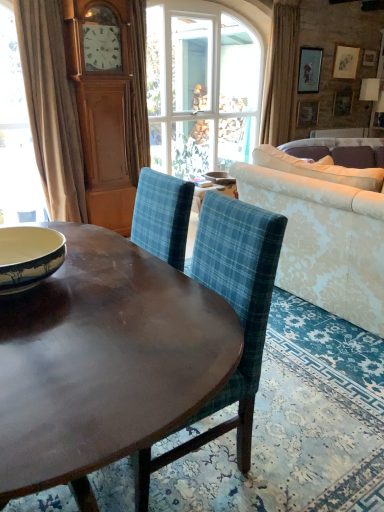
Image resolution: width=384 pixels, height=512 pixels. Describe the element at coordinates (307, 113) in the screenshot. I see `wooden picture frame at upper right, the 1th picture frame from the bottom` at that location.

This screenshot has width=384, height=512. What do you see at coordinates (309, 70) in the screenshot? I see `matte wooden picture frame at upper right, marked as the first picture frame in a top-to-bottom arrangement` at bounding box center [309, 70].

This screenshot has height=512, width=384. What do you see at coordinates (51, 108) in the screenshot? I see `beige fabric curtain at left, the first curtain positioned from the left` at bounding box center [51, 108].

Image resolution: width=384 pixels, height=512 pixels. Describe the element at coordinates (280, 75) in the screenshot. I see `beige fabric curtain at upper right, the 1th curtain viewed from the back` at that location.

This screenshot has height=512, width=384. Identify the location of beige fabric curtain at upper right, the 1th curtain viewed from the back. (280, 75).

Image resolution: width=384 pixels, height=512 pixels. What do you see at coordinates (235, 311) in the screenshot? I see `blue plaid fabric chair at center` at bounding box center [235, 311].

Image resolution: width=384 pixels, height=512 pixels. Find the location of `clear glass window at center`. clear glass window at center is located at coordinates (201, 87).

This screenshot has width=384, height=512. What do you see at coordinates (201, 87) in the screenshot?
I see `clear glass window at center` at bounding box center [201, 87].

What are the coordinates of `shiny brown wood coffee table at center` in the screenshot? It's located at (104, 362).

From the picture: Considering the relative positions of matte wooden picture frame at upper right, the 2th picture frame in the bottom-to-top sequence, and clear glass window at center in the image provided, is matte wooden picture frame at upper right, the 2th picture frame in the bottom-to-top sequence, to the right of clear glass window at center from the viewer's perspective?

Correct, you'll find matte wooden picture frame at upper right, the 2th picture frame in the bottom-to-top sequence, to the right of clear glass window at center.

From the image's perspective, between matte wooden picture frame at upper right, marked as the first picture frame in a top-to-bottom arrangement, and clear glass window at center, which one is located above?

matte wooden picture frame at upper right, marked as the first picture frame in a top-to-bottom arrangement, appears higher in the image.

Considering the relative sizes of matte wooden picture frame at upper right, marked as the first picture frame in a top-to-bottom arrangement, and clear glass window at center in the image provided, is matte wooden picture frame at upper right, marked as the first picture frame in a top-to-bottom arrangement, smaller than clear glass window at center?

Indeed, matte wooden picture frame at upper right, marked as the first picture frame in a top-to-bottom arrangement, has a smaller size compared to clear glass window at center.

What's the angular difference between blue plaid fabric chair at center and beige fabric curtain at upper right, positioned as the second curtain in front-to-back order,'s facing directions?

The angle between the facing direction of blue plaid fabric chair at center and the facing direction of beige fabric curtain at upper right, positioned as the second curtain in front-to-back order, is 88.7 degrees.

Are blue plaid fabric chair at center and beige fabric curtain at upper right, the 1th curtain viewed from the back, far apart?

blue plaid fabric chair at center is positioned a significant distance from beige fabric curtain at upper right, the 1th curtain viewed from the back.

Based on the photo, could beige fabric curtain at upper right, the 1th curtain viewed from the back, be considered to be inside blue plaid fabric chair at center?

No.

Does blue plaid fabric chair at center have a larger size compared to beige fabric curtain at upper right, positioned as the second curtain in front-to-back order?

Yes.

Is blue and white ceramic bowl at left, which is counted as the 2th bowl, starting from the top, positioned far away from damask fabric couch at right?

Yes.

Relative to damask fabric couch at right, is blue and white ceramic bowl at left, marked as the 2th bowl in a back-to-front arrangement, in front or behind?

blue and white ceramic bowl at left, marked as the 2th bowl in a back-to-front arrangement, is positioned closer to the viewer than damask fabric couch at right.

Is blue and white ceramic bowl at left, the 2th bowl in the right-to-left sequence, not within damask fabric couch at right?

Yes, blue and white ceramic bowl at left, the 2th bowl in the right-to-left sequence, is located beyond the bounds of damask fabric couch at right.

The height and width of the screenshot is (512, 384). What are the coordinates of `bowl below the damask fabric couch at right (from the image's perspective)` in the screenshot? It's located at (28, 256).

Considering the relative sizes of clear glass window at center and shiny brown wood coffee table at center in the image provided, is clear glass window at center wider than shiny brown wood coffee table at center?

Incorrect, the width of clear glass window at center does not surpass that of shiny brown wood coffee table at center.

Do you think clear glass window at center is within shiny brown wood coffee table at center, or outside of it?

clear glass window at center is spatially situated outside shiny brown wood coffee table at center.

Which point is more distant from viewer, (178, 42) or (31, 448)?

The point (178, 42) is farther.

From a real-world perspective, which is physically above, damask fabric couch at right or white glossy bowl at center, which is the 2th bowl in front-to-back order?

In real-world perspective, damask fabric couch at right is above.

Considering the positions of objects damask fabric couch at right and white glossy bowl at center, acting as the second bowl starting from the bottom, in the image provided, who is behind, damask fabric couch at right or white glossy bowl at center, acting as the second bowl starting from the bottom,?

white glossy bowl at center, acting as the second bowl starting from the bottom, is behind.

Is damask fabric couch at right facing away from white glossy bowl at center, arranged as the 1th bowl when viewed from the top?

damask fabric couch at right is not turned away from white glossy bowl at center, arranged as the 1th bowl when viewed from the top.

Considering the points (277, 280) and (222, 182), which point is in front, point (277, 280) or point (222, 182)?

The point (277, 280) is in front.

The width and height of the screenshot is (384, 512). What are the coordinates of `bowl that is the 1st one when counting downward from the beige fabric curtain at left, the 1th curtain viewed from the front (from the image's perspective)` in the screenshot? It's located at (220, 178).

Consider the image. Considering the positions of objects beige fabric curtain at left, the first curtain positioned from the left, and white glossy bowl at center, the 1th bowl viewed from the right, in the image provided, who is more to the right, beige fabric curtain at left, the first curtain positioned from the left, or white glossy bowl at center, the 1th bowl viewed from the right,?

From the viewer's perspective, white glossy bowl at center, the 1th bowl viewed from the right, appears more on the right side.

Which is nearer, (77,194) or (220,174)?

Point (77,194) is farther from the camera than point (220,174).

Which is closer to the camera, (x=375, y=318) or (x=293, y=45)?

Point (x=375, y=318) is positioned closer to the camera compared to point (x=293, y=45).

Does damask fabric couch at right have a lesser width compared to beige fabric curtain at upper right, which is the first curtain from right to left?

No.

Consider the image. Which object is more forward, damask fabric couch at right or beige fabric curtain at upper right, the second curtain viewed from the left?

damask fabric couch at right is more forward.

Locate an element on the screen. the 1st picture frame behind the clear glass window at center, starting your count from the anchor is located at coordinates (309, 70).

Locate an element on the screen. curtain that is on the right side of blue plaid fabric chair at center is located at coordinates (280, 75).

When comparing their distances from matte wooden picture frame at upper right, the 2th picture frame in the bottom-to-top sequence, does blue and white ceramic bowl at left, the first bowl viewed from the left, or damask fabric couch at right seem further?

The object further to matte wooden picture frame at upper right, the 2th picture frame in the bottom-to-top sequence, is blue and white ceramic bowl at left, the first bowl viewed from the left.

Considering their positions, is wooden picture frame at upper right, the 1th picture frame from the bottom, positioned further to matte wooden picture frame at upper right, marked as the first picture frame in a top-to-bottom arrangement, than beige fabric curtain at left, the 1th curtain viewed from the front?

beige fabric curtain at left, the 1th curtain viewed from the front.

When comparing their distances from blue and white ceramic bowl at left, positioned as the 1th bowl in front-to-back order, does shiny brown wood coffee table at center or clear glass window at center seem closer?

shiny brown wood coffee table at center.

Based on their spatial positions, is matte wooden picture frame at upper right, marked as the first picture frame in a top-to-bottom arrangement, or beige fabric curtain at upper right, the 1th curtain viewed from the back, closer to white glossy bowl at center, placed as the second bowl when sorted from left to right?

beige fabric curtain at upper right, the 1th curtain viewed from the back.

Consider the image. When comparing their distances from beige fabric curtain at upper right, the second curtain viewed from the left, does white glossy bowl at center, arranged as the first bowl when viewed from the back, or beige fabric curtain at left, the second curtain in the right-to-left sequence, seem further?

Among the two, beige fabric curtain at left, the second curtain in the right-to-left sequence, is located further to beige fabric curtain at upper right, the second curtain viewed from the left.

Considering their positions, is beige fabric curtain at left, which appears as the second curtain when viewed from the back, positioned closer to clear glass window at center than shiny brown wood coffee table at center?

Based on the image, beige fabric curtain at left, which appears as the second curtain when viewed from the back, appears to be nearer to clear glass window at center.

Looking at this image, which object lies nearer to the anchor point blue and white ceramic bowl at left, the 2th bowl in the right-to-left sequence, damask fabric couch at right or matte wooden picture frame at upper right, marked as the first picture frame in a top-to-bottom arrangement?

damask fabric couch at right.

Which object lies further to the anchor point beige fabric curtain at left, the 1th curtain viewed from the front, beige fabric curtain at upper right, which is the first curtain from right to left, or shiny brown wood coffee table at center?

Based on the image, beige fabric curtain at upper right, which is the first curtain from right to left, appears to be further to beige fabric curtain at left, the 1th curtain viewed from the front.

Where is `studio couch between blue plaid fabric chair at center and beige fabric curtain at upper right, the second curtain viewed from the left, along the z-axis`? The image size is (384, 512). studio couch between blue plaid fabric chair at center and beige fabric curtain at upper right, the second curtain viewed from the left, along the z-axis is located at coordinates (322, 237).

Find the location of `curtain between blue and white ceramic bowl at left, marked as the 2th bowl in a back-to-front arrangement, and beige fabric curtain at upper right, positioned as the second curtain in front-to-back order, along the z-axis`. curtain between blue and white ceramic bowl at left, marked as the 2th bowl in a back-to-front arrangement, and beige fabric curtain at upper right, positioned as the second curtain in front-to-back order, along the z-axis is located at coordinates (51, 108).

At what (x,y) coordinates should I click in order to perform the action: click on curtain between shiny brown wood coffee table at center and white glossy bowl at center, arranged as the 1th bowl when viewed from the top, from front to back. Please return your answer as a coordinate pair (x, y). This screenshot has height=512, width=384. Looking at the image, I should click on (51, 108).

Locate an element on the screen. picture frame between blue plaid fabric chair at center and wooden picture frame at upper right, the 1th picture frame from the bottom, in the front-back direction is located at coordinates (309, 70).